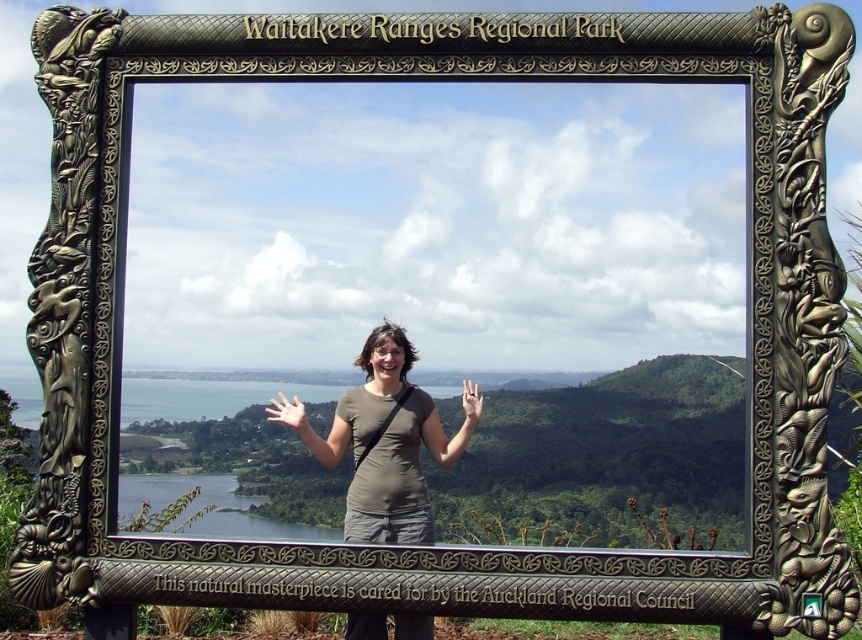
Who is more forward, (398, 452) or (475, 387)?

Positioned in front is point (398, 452).

Is matte brown shirt at center smaller than matte skin hand at center?

No.

What do you see at coordinates (386, 444) in the screenshot?
I see `matte brown shirt at center` at bounding box center [386, 444].

What are the coordinates of `matte brown shirt at center` in the screenshot? It's located at (386, 444).

Does white matte hand at center appear on the right side of matte skin hand at center?

No, white matte hand at center is not to the right of matte skin hand at center.

Image resolution: width=862 pixels, height=640 pixels. What do you see at coordinates (286, 412) in the screenshot? I see `white matte hand at center` at bounding box center [286, 412].

Identify the location of white matte hand at center. (286, 412).

The height and width of the screenshot is (640, 862). What do you see at coordinates (386, 444) in the screenshot?
I see `matte brown shirt at center` at bounding box center [386, 444].

Does point (340, 444) come closer to viewer compared to point (267, 410)?

Yes, it is.

You are a GUI agent. You are given a task and a screenshot of the screen. Output one action in this format:
    pyautogui.click(x=<x>, y=<y>)
    Task: Click on the matte brown shirt at center
    
    Given the screenshot: What is the action you would take?
    pyautogui.click(x=386, y=444)